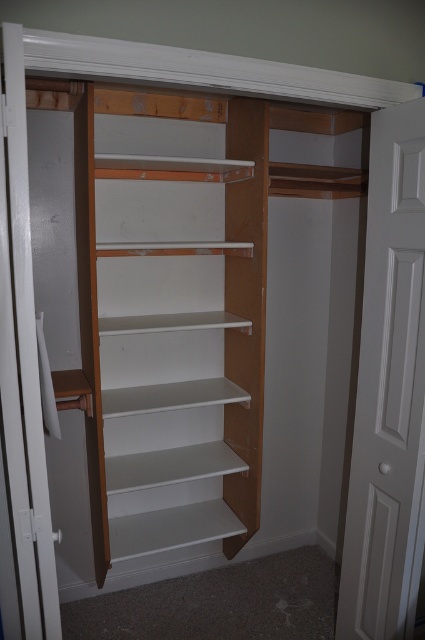
Does white painted wood bookshelf at center have a larger size compared to white painted wood door at right?

Correct, white painted wood bookshelf at center is larger in size than white painted wood door at right.

Is point (147, 452) positioned behind point (380, 476)?

Yes, it is.

I want to click on white painted wood bookshelf at center, so click(x=172, y=328).

Who is positioned more to the right, white painted wood bookshelf at center or white glossy door at left?

From the viewer's perspective, white painted wood bookshelf at center appears more on the right side.

I want to click on white painted wood bookshelf at center, so [172, 328].

Which is in front, point (246, 448) or point (39, 381)?

Point (39, 381) is in front.

Locate an element on the screen. The image size is (425, 640). white painted wood bookshelf at center is located at coordinates (172, 328).

Which is behind, point (385, 348) or point (50, 570)?

The point (385, 348) is behind.

Who is higher up, white painted wood door at right or white glossy door at left?

Positioned higher is white glossy door at left.

Locate an element on the screen. white painted wood door at right is located at coordinates (388, 392).

Find the location of a particular element. This screenshot has width=425, height=640. white painted wood door at right is located at coordinates (388, 392).